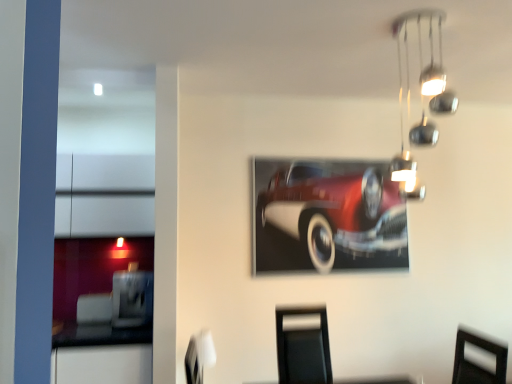
Question: From the image's perspective, is shiny red car at center beneath chrome metallic light fixture at upper right?

Choices:
 (A) yes
 (B) no

Answer: (A)

Question: Does shiny red car at center have a greater width compared to chrome metallic light fixture at upper right?

Choices:
 (A) yes
 (B) no

Answer: (B)

Question: Does shiny red car at center have a larger size compared to chrome metallic light fixture at upper right?

Choices:
 (A) yes
 (B) no

Answer: (B)

Question: Is chrome metallic light fixture at upper right at the back of shiny red car at center?

Choices:
 (A) yes
 (B) no

Answer: (B)

Question: Is shiny red car at center thinner than chrome metallic light fixture at upper right?

Choices:
 (A) no
 (B) yes

Answer: (B)

Question: Is shiny red car at center oriented towards chrome metallic light fixture at upper right?

Choices:
 (A) yes
 (B) no

Answer: (A)

Question: Is the depth of white fabric swivel chair at lower center less than that of chrome metallic light fixture at upper right?

Choices:
 (A) yes
 (B) no

Answer: (B)

Question: Does white fabric swivel chair at lower center have a lesser width compared to chrome metallic light fixture at upper right?

Choices:
 (A) yes
 (B) no

Answer: (A)

Question: Does white fabric swivel chair at lower center contain chrome metallic light fixture at upper right?

Choices:
 (A) yes
 (B) no

Answer: (B)

Question: Does white fabric swivel chair at lower center appear on the left side of chrome metallic light fixture at upper right?

Choices:
 (A) yes
 (B) no

Answer: (A)

Question: From the image's perspective, does white fabric swivel chair at lower center appear higher than chrome metallic light fixture at upper right?

Choices:
 (A) yes
 (B) no

Answer: (B)

Question: From a real-world perspective, is white fabric swivel chair at lower center beneath chrome metallic light fixture at upper right?

Choices:
 (A) no
 (B) yes

Answer: (B)

Question: Is shiny red car at center located outside white fabric swivel chair at lower center?

Choices:
 (A) no
 (B) yes

Answer: (B)